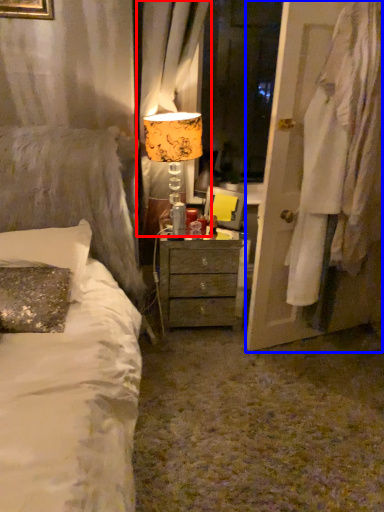
Question: Among these objects, which one is nearest to the camera, curtain (highlighted by a red box) or door (highlighted by a blue box)?

Choices:
 (A) curtain
 (B) door

Answer: (B)